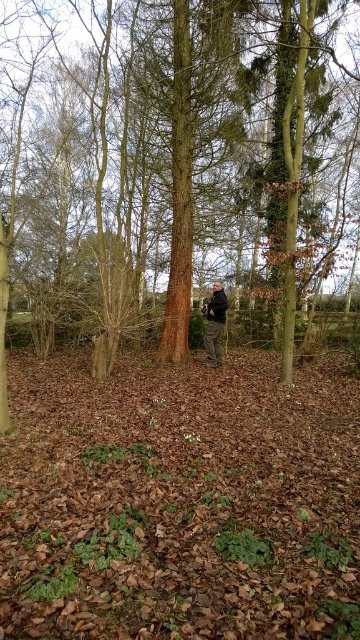
Who is taller, brown wood tree at center or dark gray jacket at center?

Standing taller between the two is brown wood tree at center.

What do you see at coordinates (54, 144) in the screenshot? The height and width of the screenshot is (640, 360). I see `brown wood tree at center` at bounding box center [54, 144].

At what (x,y) coordinates should I click in order to perform the action: click on brown wood tree at center. Please return your answer as a coordinate pair (x, y). Looking at the image, I should click on (54, 144).